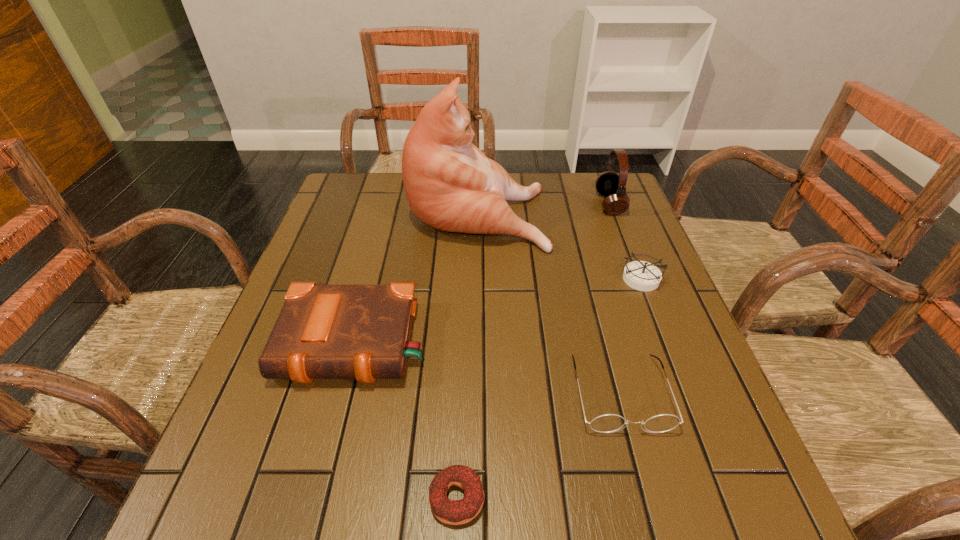
Find the location of `blank space located on the ear pads of the headset`. blank space located on the ear pads of the headset is located at coordinates (542, 204).

Identify the location of vacant space located on the spine side of the Bible. The image size is (960, 540). (330, 440).

You are a GUI agent. You are given a task and a screenshot of the screen. Output one action in this format:
    pyautogui.click(x=<x>, y=<y>)
    Task: Click on the vacant space positioned 0.200m on the front of the compass
    The image size is (960, 540).
    Given the screenshot: What is the action you would take?
    [672, 363]

Find the location of a particular element. The height and width of the screenshot is (540, 960). free space located on the front-facing side of the spectacles is located at coordinates (656, 529).

Where is `blank space located 0.200m on the left of the doughnut`? The image size is (960, 540). blank space located 0.200m on the left of the doughnut is located at coordinates pyautogui.click(x=302, y=498).

Locate an element on the screen. cat that is at the far edge is located at coordinates (450, 184).

Find the location of a particular element. The width and height of the screenshot is (960, 540). headset positioned at the far edge is located at coordinates (610, 184).

Where is `object that is at the near edge`? The height and width of the screenshot is (540, 960). object that is at the near edge is located at coordinates (453, 512).

Identify the location of object at the left edge. The width and height of the screenshot is (960, 540). (362, 332).

You are a GUI agent. You are given a task and a screenshot of the screen. Output one action in this format:
    pyautogui.click(x=<x>, y=<y>)
    Task: Click on the headset that is positioned at the right edge
    
    Given the screenshot: What is the action you would take?
    pyautogui.click(x=610, y=184)